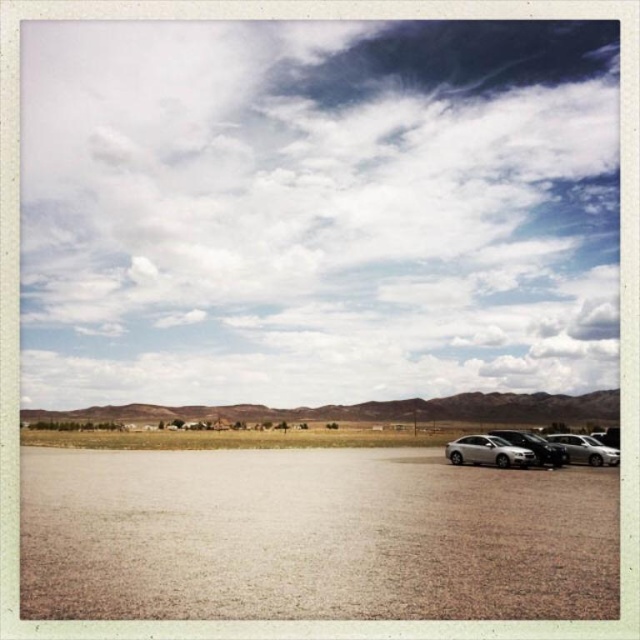
Does white fluffy cloud at upper center appear on the right side of satin silver sedan at lower right?

No, white fluffy cloud at upper center is not to the right of satin silver sedan at lower right.

Locate an element on the screen. white fluffy cloud at upper center is located at coordinates (317, 209).

Identify the location of brown sandy dirt field at lower center. (310, 536).

This screenshot has width=640, height=640. Find the location of `brown sandy dirt field at lower center`. brown sandy dirt field at lower center is located at coordinates (310, 536).

Does white fluffy cloud at upper center have a greater height compared to satin silver sedan at center?

Indeed, white fluffy cloud at upper center has a greater height compared to satin silver sedan at center.

Does point (448, 275) come in front of point (515, 458)?

No, it is not.

Does point (268, 54) come closer to viewer compared to point (461, 436)?

No, (268, 54) is further to viewer.

Where is `white fluffy cloud at upper center`? white fluffy cloud at upper center is located at coordinates (317, 209).